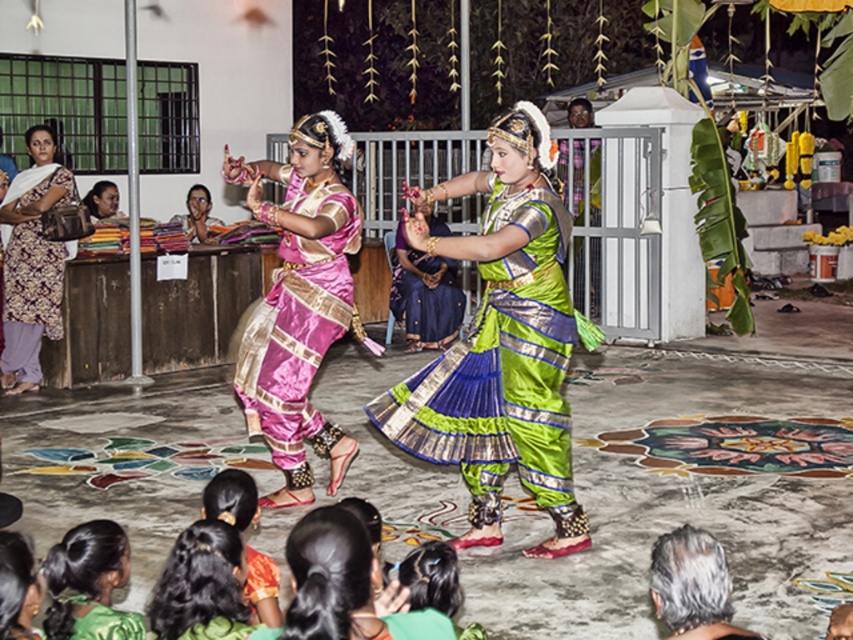
Question: Which point is closer to the camera?

Choices:
 (A) green silk saree at center
 (B) silky green saree at lower left
 (C) green silk saree at lower left

Answer: (B)

Question: Does green silk saree at center have a greater width compared to pink satin saree at center?

Choices:
 (A) no
 (B) yes

Answer: (B)

Question: Which point is farther from the camera taking this photo?

Choices:
 (A) (241, 616)
 (B) (96, 579)
 (C) (415, 372)

Answer: (C)

Question: Does printed cotton kurta at left come behind green silk saree at lower left?

Choices:
 (A) no
 (B) yes

Answer: (B)

Question: Which object is farther from the camera taking this photo?

Choices:
 (A) green silk saree at lower left
 (B) silky green saree at lower left
 (C) printed cotton kurta at left
 (D) green silk saree at center

Answer: (C)

Question: Can you confirm if printed cotton kurta at left is positioned below silky green saree at lower left?

Choices:
 (A) yes
 (B) no

Answer: (B)